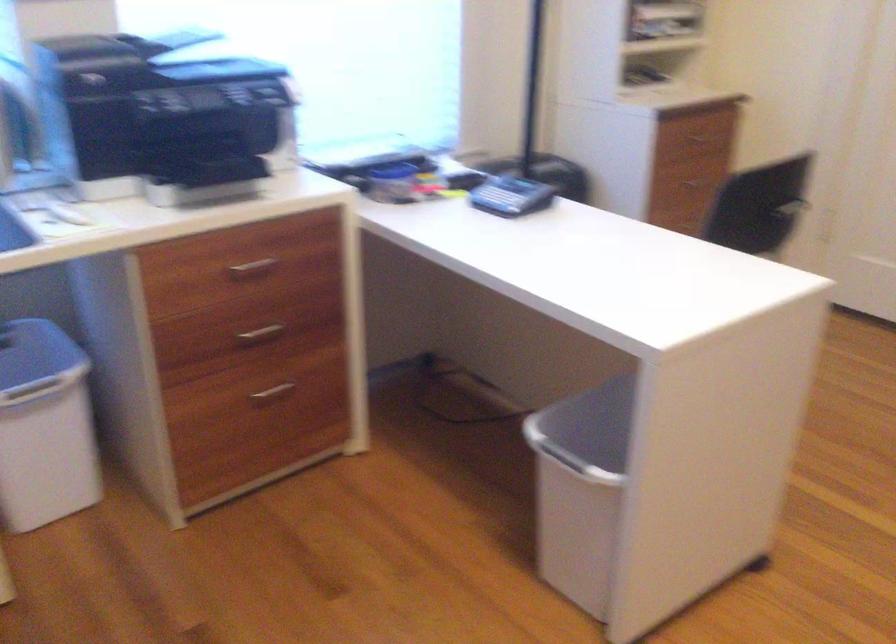
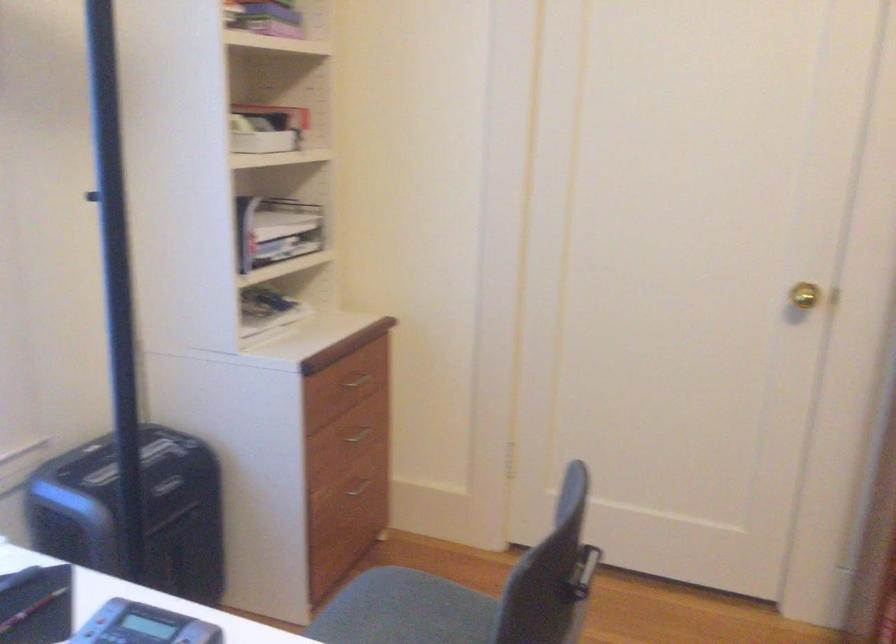
Find the pixel in the second image that matches [676,223] in the first image.

(359, 485)